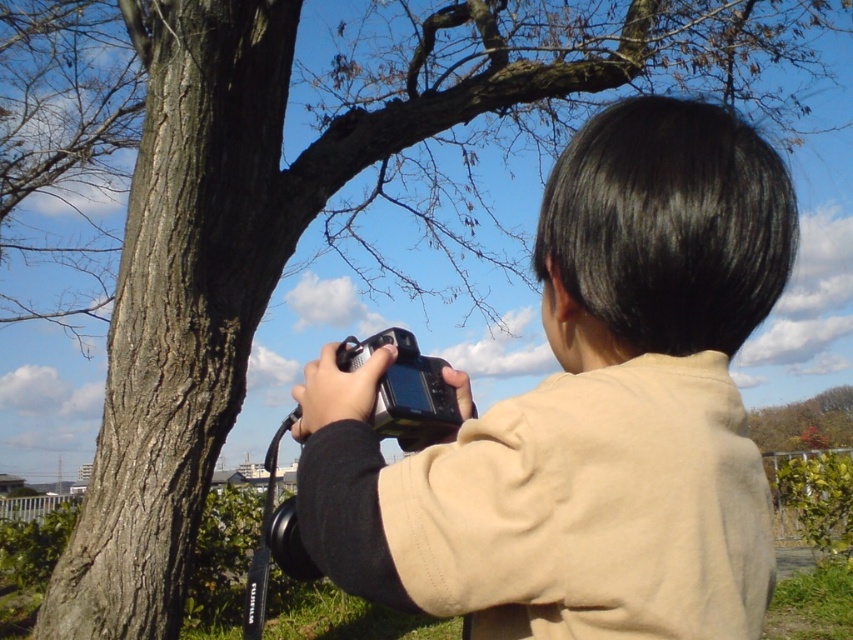
You are a photographer trying to decide which camera to use for a portrait shoot. You have two options in front of you, the matte black camera at center and the black plastic camera at center. Based on their sizes, which one would you choose if you prefer a taller camera?

The matte black camera at center is much taller than the black plastic camera at center, so you should choose the matte black camera at center for a taller option.

You are a photographer trying to adjust your camera settings. You notice two cameras in the scene. Which one is closer to you, the matte black camera at center or the other camera?

The matte black camera at center is closer to you since it is only 69.41 centimeters away from the other camera in the scene.